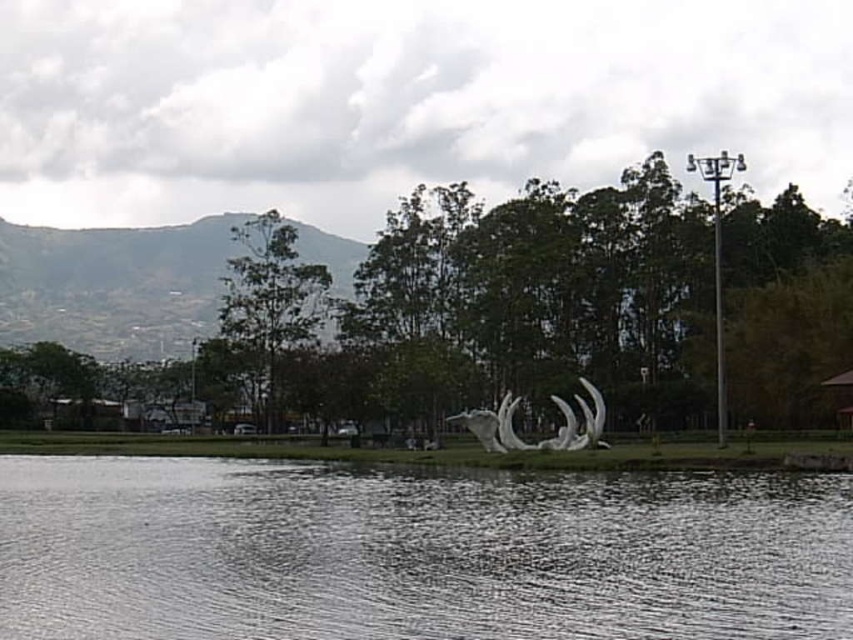
Which is more to the left, clear water at center or white glossy sculpture at center?

clear water at center is more to the left.

Between point (177, 579) and point (511, 406), which one is positioned behind?

The point (511, 406) is more distant.

Identify the location of clear water at center. (415, 554).